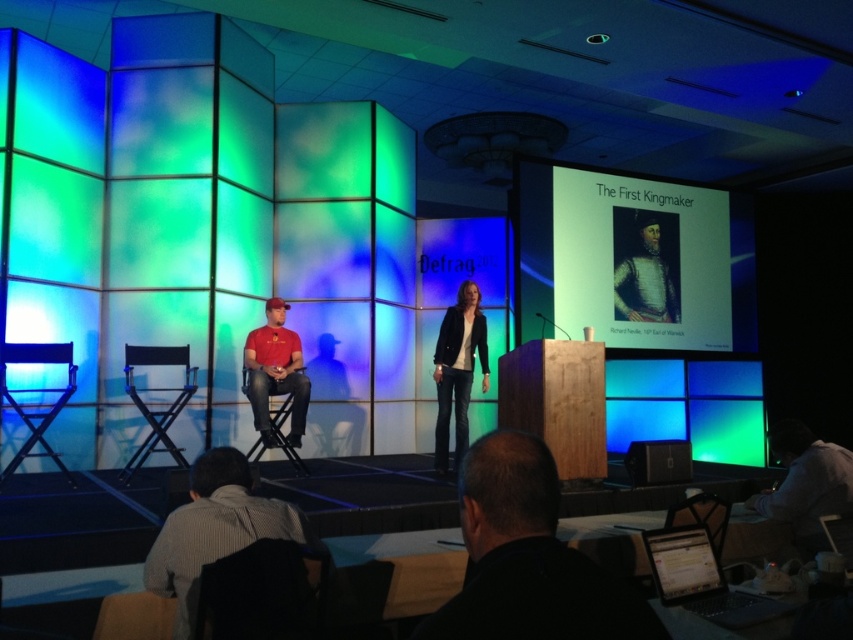
Looking at this image, is matte black portrait at upper right closer to camera compared to matte black chair at center?

No, it is not.

Is point (654, 228) positioned in front of point (288, 408)?

That is False.

Locate an element on the screen. This screenshot has height=640, width=853. matte black portrait at upper right is located at coordinates (645, 278).

Who is higher up, gray striped shirt at lower left or black leather jacket at center?

Positioned higher is black leather jacket at center.

Can you confirm if gray striped shirt at lower left is positioned below black leather jacket at center?

Yes.

Is point (173, 534) less distant than point (456, 364)?

Yes, it is.

Image resolution: width=853 pixels, height=640 pixels. In order to click on gray striped shirt at lower left in this screenshot , I will do `click(215, 529)`.

Can you confirm if black leather jacket at center is smaller than metallic blue chair at left?

Yes, black leather jacket at center is smaller than metallic blue chair at left.

Can you confirm if black leather jacket at center is positioned below metallic blue chair at left?

No.

Is point (445, 342) positioned before point (47, 355)?

That is False.

Find the location of a particular element. The height and width of the screenshot is (640, 853). black leather jacket at center is located at coordinates (457, 371).